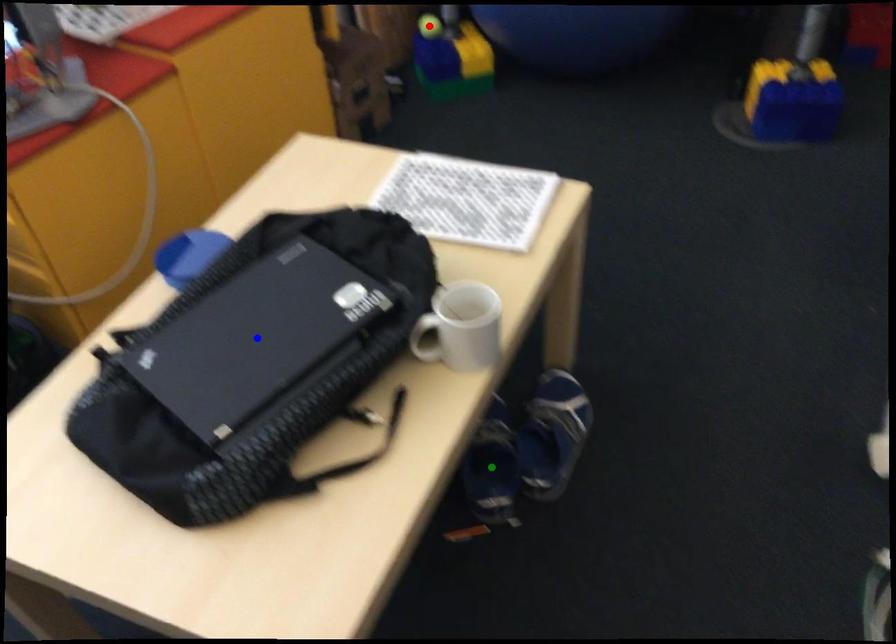
Order these from nearest to farthest:
red point, green point, blue point

blue point < green point < red point